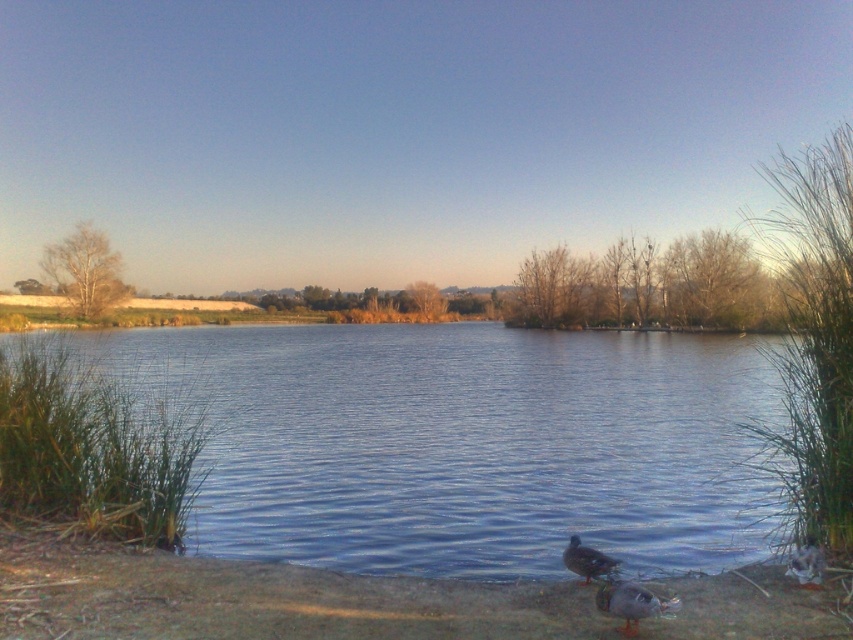
Is blue water at center wider than dark brown feathers at lower center?

Correct, the width of blue water at center exceeds that of dark brown feathers at lower center.

Who is higher up, blue water at center or dark brown feathers at lower center?

blue water at center

What do you see at coordinates (463, 442) in the screenshot?
I see `blue water at center` at bounding box center [463, 442].

What are the coordinates of `blue water at center` in the screenshot? It's located at (463, 442).

Can you confirm if dark gray feathers at lower right is taller than dark brown feathers at lower center?

No.

Is dark gray feathers at lower right behind dark brown feathers at lower center?

No, dark gray feathers at lower right is closer to the viewer.

Identify the location of dark gray feathers at lower right. The width and height of the screenshot is (853, 640). point(630,604).

At what (x,y) coordinates should I click in order to perform the action: click on dark gray feathers at lower right. Please return your answer as a coordinate pair (x, y). This screenshot has height=640, width=853. Looking at the image, I should click on (630, 604).

Does blue water at center come in front of dark gray feathers at lower right?

No, it is not.

Which is below, blue water at center or dark gray feathers at lower right?

Positioned lower is dark gray feathers at lower right.

Identify the location of blue water at center. (463, 442).